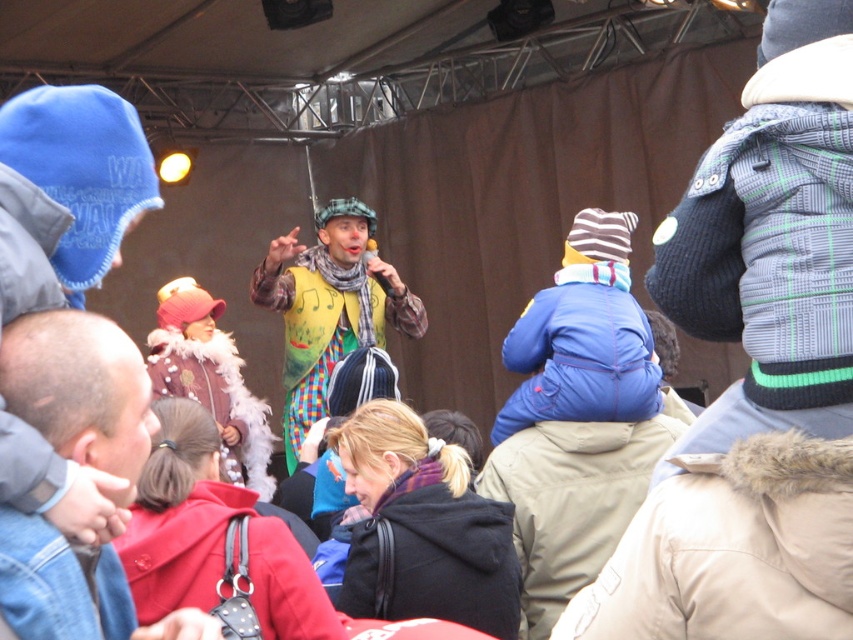
Who is more forward, (428, 600) or (252, 474)?

Point (428, 600) is more forward.

Where is `black fleece jacket at lower center`? black fleece jacket at lower center is located at coordinates (434, 556).

Describe the element at coordinates (434, 556) in the screenshot. The image size is (853, 640). I see `black fleece jacket at lower center` at that location.

The height and width of the screenshot is (640, 853). Find the location of `black fleece jacket at lower center`. black fleece jacket at lower center is located at coordinates (434, 556).

In the scene shown: Does black fleece jacket at lower center appear on the left side of yellow fabric clown at center?

Incorrect, black fleece jacket at lower center is not on the left side of yellow fabric clown at center.

Is black fleece jacket at lower center shorter than yellow fabric clown at center?

Yes, black fleece jacket at lower center is shorter than yellow fabric clown at center.

Where is `black fleece jacket at lower center`? The width and height of the screenshot is (853, 640). black fleece jacket at lower center is located at coordinates (434, 556).

Based on the photo, can you confirm if denim jacket at lower left is positioned to the left of velvet fur coat at center?

Incorrect, denim jacket at lower left is not on the left side of velvet fur coat at center.

Which is behind, point (138, 360) or point (252, 472)?

The point (252, 472) is behind.

Is point (129, 378) positioned before point (257, 488)?

Yes, it is in front of point (257, 488).

The height and width of the screenshot is (640, 853). In order to click on denim jacket at lower left in this screenshot , I will do `click(80, 388)`.